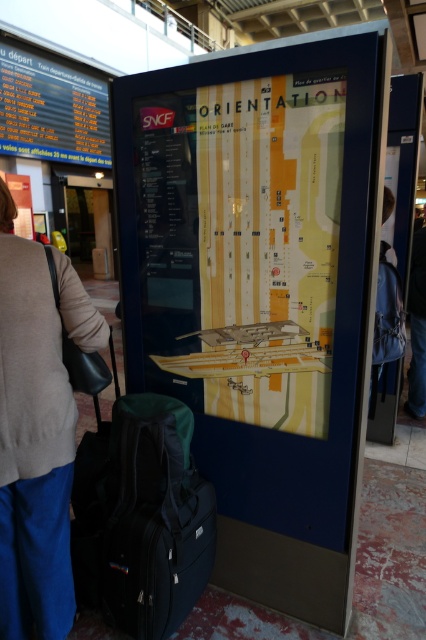
Question: Which of these objects is positioned closest to the light beige sweater at center?

Choices:
 (A) black fabric suitcase at lower left
 (B) yellow paper map at center

Answer: (A)

Question: From the image, what is the correct spatial relationship of light beige sweater at center in relation to black fabric suitcase at lower left?

Choices:
 (A) left
 (B) right

Answer: (A)

Question: Does yellow paper map at center have a greater width compared to light beige sweater at center?

Choices:
 (A) no
 (B) yes

Answer: (B)

Question: Does light beige sweater at center come in front of black fabric suitcase at lower left?

Choices:
 (A) yes
 (B) no

Answer: (A)

Question: Among these points, which one is farthest from the camera?

Choices:
 (A) (310, 125)
 (B) (97, 456)

Answer: (B)

Question: Which of the following is the farthest from the observer?

Choices:
 (A) yellow paper map at center
 (B) black fabric suitcase at lower left

Answer: (B)